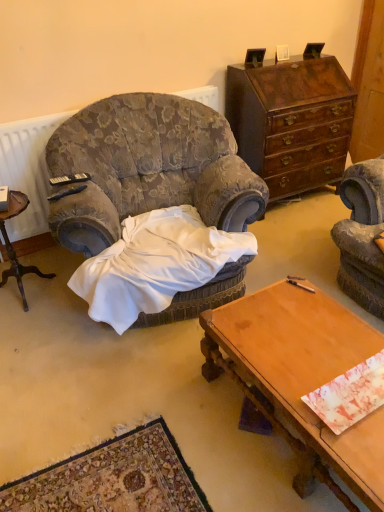
What is the approximate height of black plastic remote control at left, acting as the second remote control starting from the back?

black plastic remote control at left, acting as the second remote control starting from the back, is 1.40 inches in height.

Image resolution: width=384 pixels, height=512 pixels. I want to click on velvet-patterned armchair at center, so click(148, 168).

Where is `marbled paper at center`? The width and height of the screenshot is (384, 512). marbled paper at center is located at coordinates (350, 395).

This screenshot has width=384, height=512. I want to click on wooden nightstand at left, so coord(13,248).

What is the approximate width of black plastic remote control at upper left, placed as the 2th remote control when sorted from front to back?

black plastic remote control at upper left, placed as the 2th remote control when sorted from front to back, is 2.40 inches in width.

The image size is (384, 512). What are the coordinates of `black plastic remote control at left, the 1th remote control from the front` in the screenshot? It's located at (67, 192).

This screenshot has width=384, height=512. Find the location of `the 2nd remote control to the left of the white satin blanket at center, counting from the anchor's position`. the 2nd remote control to the left of the white satin blanket at center, counting from the anchor's position is located at coordinates (69, 179).

Looking at this image, is black plastic remote control at upper left, placed as the 2th remote control when sorted from front to back, closer to the viewer compared to white satin blanket at center?

No, black plastic remote control at upper left, placed as the 2th remote control when sorted from front to back, is behind white satin blanket at center.

Consider the image. Is black plastic remote control at upper left, placed as the 2th remote control when sorted from front to back, beside white satin blanket at center?

black plastic remote control at upper left, placed as the 2th remote control when sorted from front to back, is not next to white satin blanket at center, and they're not touching.

Looking at this image, can you confirm if black plastic remote control at upper left, the 1th remote control positioned from the back, is thinner than white satin blanket at center?

Correct, the width of black plastic remote control at upper left, the 1th remote control positioned from the back, is less than that of white satin blanket at center.

Is velvet-patterned armchair at center surrounding white satin blanket at center?

Yes, velvet-patterned armchair at center is surrounding white satin blanket at center.

Is point (245, 206) farther from camera compared to point (104, 288)?

Yes.

Can you tell me how much velvet-patterned armchair at center and white satin blanket at center differ in facing direction?

They differ by 2.14 degrees in their facing directions.

Which of these two, velvet-patterned armchair at center or white satin blanket at center, is smaller?

With smaller size is white satin blanket at center.

In the image, there is a wooden nightstand at left. Identify the location of chair above it (from the image's perspective). (148, 168).

Is wooden nightstand at left in contact with velvet-patterned armchair at center?

wooden nightstand at left and velvet-patterned armchair at center are not in contact.

In the scene shown: How many degrees apart are the facing directions of wooden nightstand at left and velvet-patterned armchair at center?

They differ by 14.2 degrees in their facing directions.

Consider the image. How much distance is there between wooden nightstand at left and velvet-patterned armchair at center?

28.10 inches.

In the scene shown: Is wooden desk at lower right at the right side of marbled paper at center?

No, wooden desk at lower right is not to the right of marbled paper at center.

Is wooden desk at lower right in front of or behind marbled paper at center in the image?

wooden desk at lower right is positioned closer to the viewer than marbled paper at center.

Considering the relative sizes of wooden desk at lower right and marbled paper at center in the image provided, is wooden desk at lower right bigger than marbled paper at center?

Indeed, wooden desk at lower right has a larger size compared to marbled paper at center.

Consider the image. Which object is wider, wooden desk at lower right or marbled paper at center?

wooden desk at lower right is wider.

Are mahogany wood dresser at upper right and white satin blanket at center beside each other?

No, mahogany wood dresser at upper right is not making contact with white satin blanket at center.

Considering the positions of points (306, 159) and (174, 258), is point (306, 159) closer to camera compared to point (174, 258)?

No.

Does mahogany wood dresser at upper right turn towards white satin blanket at center?

No, mahogany wood dresser at upper right is not facing towards white satin blanket at center.

From a real-world perspective, is white satin blanket at center on velvet-patterned armchair at center?

A: No, from a real-world perspective, white satin blanket at center is not on top of velvet-patterned armchair at center.

Is white satin blanket at center bigger or smaller than velvet-patterned armchair at center?

Considering their sizes, white satin blanket at center takes up less space than velvet-patterned armchair at center.

Can you tell me how much white satin blanket at center and velvet-patterned armchair at center differ in facing direction?

2.14 degrees.

Locate an element on the screen. chair that is above the white satin blanket at center (from the image's perspective) is located at coordinates (148, 168).

Between black plastic remote control at left, the 1th remote control from the front, and wooden nightstand at left, which one has smaller width?

black plastic remote control at left, the 1th remote control from the front, is thinner.

Can you tell me how much black plastic remote control at left, acting as the second remote control starting from the back, and wooden nightstand at left differ in facing direction?

4.56 degrees.

Locate an element on the screen. This screenshot has width=384, height=512. remote control that is the 1st one above the wooden nightstand at left (from a real-world perspective) is located at coordinates (67, 192).

Is black plastic remote control at left, acting as the second remote control starting from the back, in front of or behind wooden nightstand at left in the image?

In the image, black plastic remote control at left, acting as the second remote control starting from the back, appears behind wooden nightstand at left.

You are a GUI agent. You are given a task and a screenshot of the screen. Output one action in this format:
    pyautogui.click(x=<x>, y=<y>)
    Task: Click on the blanket located on the right of black plastic remote control at upper left, the 1th remote control positioned from the back
    The width and height of the screenshot is (384, 512).
    Given the screenshot: What is the action you would take?
    pyautogui.click(x=155, y=264)

Identify the location of blanket below the velvet-patterned armchair at center (from the image's perspective). (155, 264).

Which object lies further to the anchor point wooden nightstand at left, mahogany wood dresser at upper right or marbled paper at center?

mahogany wood dresser at upper right lies further to wooden nightstand at left than the other object.

When comparing their distances from black plastic remote control at upper left, the 1th remote control positioned from the back, does marbled paper at center or wooden desk at lower right seem closer?

wooden desk at lower right lies closer to black plastic remote control at upper left, the 1th remote control positioned from the back, than the other object.

Based on their spatial positions, is marbled paper at center or black plastic remote control at left, the 1th remote control from the front, closer to mahogany wood dresser at upper right?

Based on the image, black plastic remote control at left, the 1th remote control from the front, appears to be nearer to mahogany wood dresser at upper right.

When comparing their distances from black plastic remote control at left, acting as the second remote control starting from the back, does white satin blanket at center or wooden nightstand at left seem further?

Based on the image, white satin blanket at center appears to be further to black plastic remote control at left, acting as the second remote control starting from the back.

Based on their spatial positions, is white satin blanket at center or wooden desk at lower right further from black plastic remote control at left, acting as the second remote control starting from the back?

wooden desk at lower right is further to black plastic remote control at left, acting as the second remote control starting from the back.

Considering their positions, is velvet-patterned armchair at center positioned closer to white satin blanket at center than marbled paper at center?

velvet-patterned armchair at center.

Based on their spatial positions, is black plastic remote control at upper left, the 1th remote control positioned from the back, or velvet-patterned armchair at center further from mahogany wood dresser at upper right?

Among the two, black plastic remote control at upper left, the 1th remote control positioned from the back, is located further to mahogany wood dresser at upper right.

Based on their spatial positions, is wooden desk at lower right or white satin blanket at center closer to velvet-patterned armchair at center?

white satin blanket at center is closer to velvet-patterned armchair at center.

The height and width of the screenshot is (512, 384). Identify the location of blanket located between velvet-patterned armchair at center and black plastic remote control at upper left, placed as the 2th remote control when sorted from front to back, in the depth direction. (155, 264).

You are a GUI agent. You are given a task and a screenshot of the screen. Output one action in this format:
    pyautogui.click(x=<x>, y=<y>)
    Task: Click on the desk between wooden nightstand at left and mahogany wood dresser at upper right in the horizontal direction
    This screenshot has width=384, height=512.
    Given the screenshot: What is the action you would take?
    pyautogui.click(x=301, y=379)

Identify the location of remote control situated between black plastic remote control at upper left, the 1th remote control positioned from the back, and marbled paper at center from left to right. The image size is (384, 512). (67, 192).

Locate an element on the screen. The height and width of the screenshot is (512, 384). desk located between wooden nightstand at left and marbled paper at center in the left-right direction is located at coordinates (301, 379).